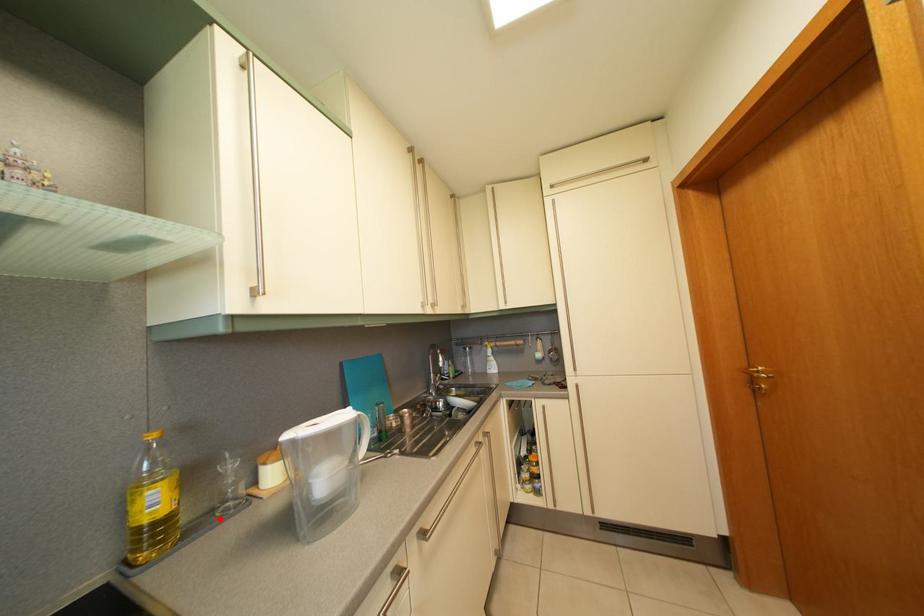
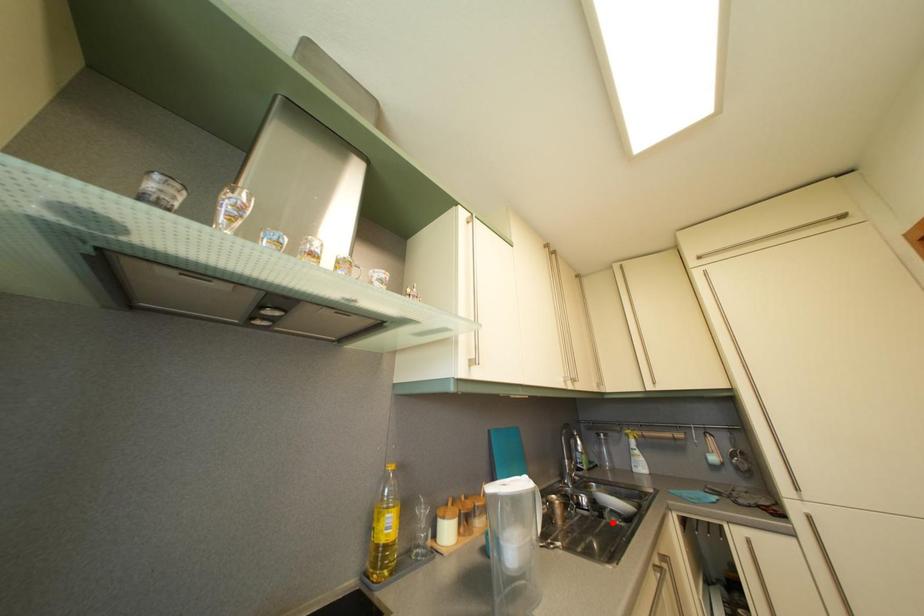
I am providing you with two images of the same scene from different viewpoints. A red point is marked on the first image and another point is marked on the second image. Are the points marked in image1 and image2 representing the same 3D position?

No